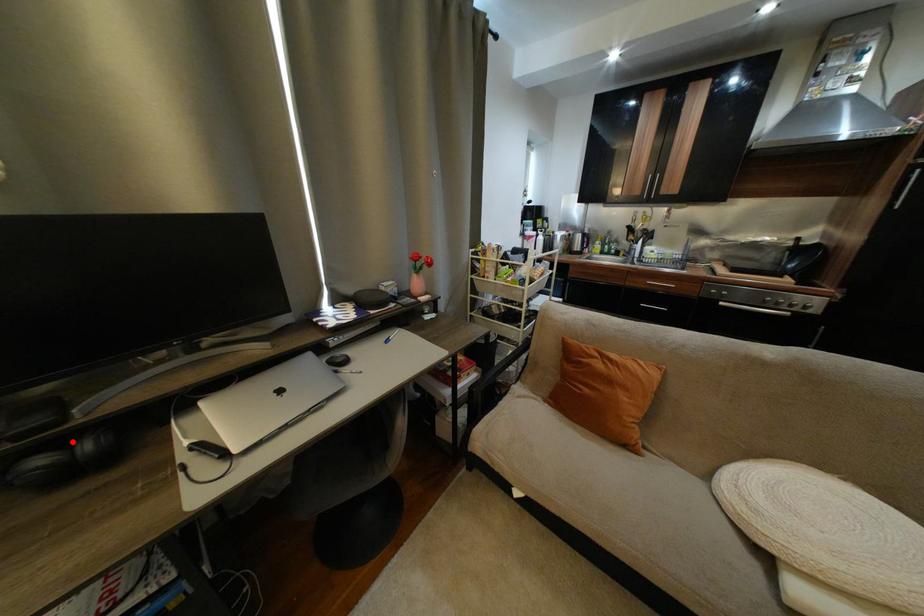
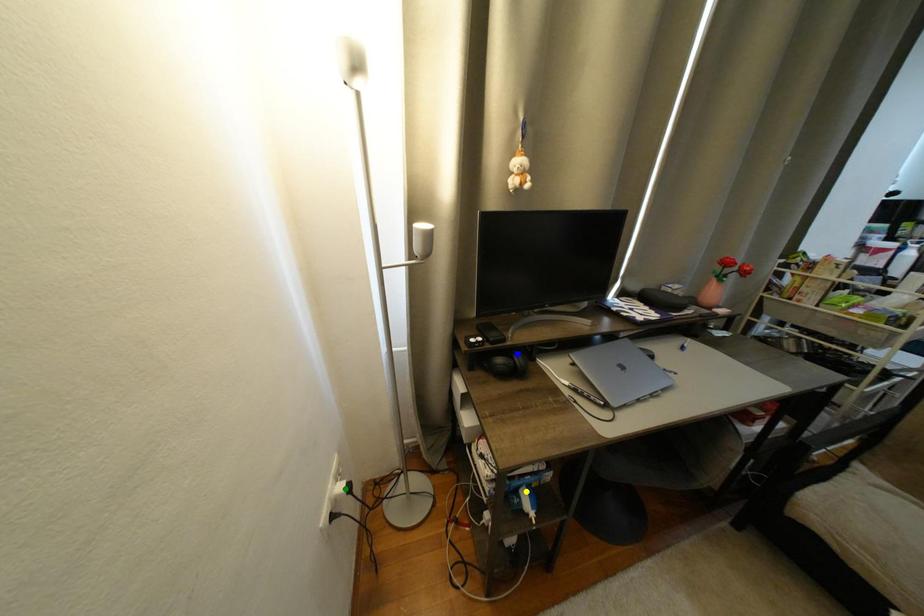
Question: I am providing you with two images of the same scene from different viewpoints. A red point is marked on the first image. You are given multiple points on the second image. In image 2, which mark is for the same physical point as the one in image 1?

Choices:
 (A) yellow point
 (B) green point
 (C) blue point

Answer: (C)